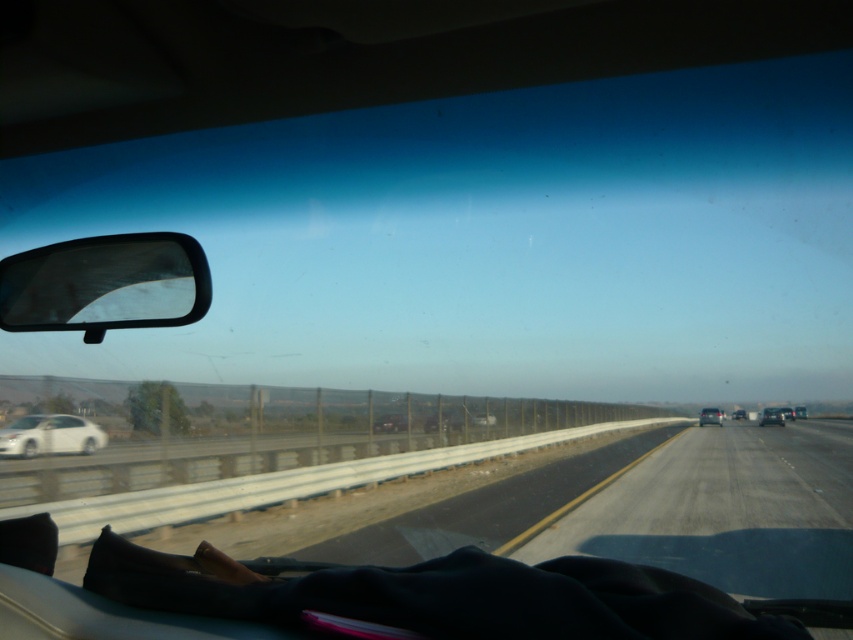
Question: Which point is farther from the camera taking this photo?

Choices:
 (A) (399, 420)
 (B) (738, 417)
 (C) (790, 419)

Answer: (B)

Question: Which point is closer to the camera taking this photo?

Choices:
 (A) (375, 432)
 (B) (700, 417)
 (C) (781, 410)
 (D) (786, 408)

Answer: (A)

Question: Does clear plastic view mirror at left appear on the right side of black glossy sedan at center-right?

Choices:
 (A) yes
 (B) no

Answer: (B)

Question: Is metallic silver sedan at right bigger than black glossy sedan at center?

Choices:
 (A) yes
 (B) no

Answer: (A)

Question: In this image, where is clear plastic view mirror at left located relative to metallic silver sedan at right?

Choices:
 (A) left
 (B) right

Answer: (A)

Question: Which point appears farthest from the camera in this image?

Choices:
 (A) (39, 419)
 (B) (787, 413)
 (C) (733, 417)
 (D) (703, 420)

Answer: (C)